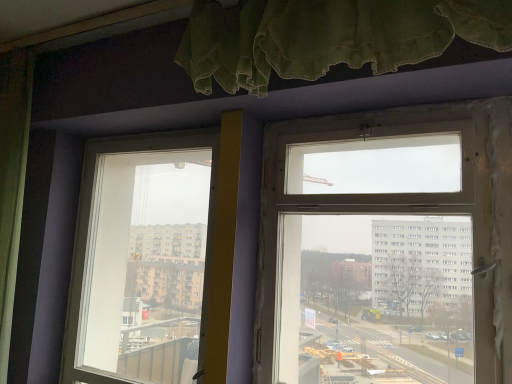
Question: Is clear glass window at upper center, which is the 1th window from right to left, in front of or behind transparent glass window at center, positioned as the 2th window in right-to-left order, in the image?

Choices:
 (A) behind
 (B) front

Answer: (B)

Question: Looking at their shapes, would you say clear glass window at upper center, which is the 1th window from right to left, is wider or thinner than transparent glass window at center, positioned as the 2th window in right-to-left order?

Choices:
 (A) wide
 (B) thin

Answer: (B)

Question: From the image's perspective, is clear glass window at upper center, which is the 2th window in left-to-right order, positioned above or below transparent glass window at center, marked as the first window in a left-to-right arrangement?

Choices:
 (A) below
 (B) above

Answer: (B)

Question: Is transparent glass window at center, positioned as the 2th window in right-to-left order, wider or thinner than clear glass window at upper center, which is the 1th window from right to left?

Choices:
 (A) wide
 (B) thin

Answer: (A)

Question: Is point (186, 135) closer or farther from the camera than point (315, 233)?

Choices:
 (A) farther
 (B) closer

Answer: (A)

Question: From the image's perspective, is transparent glass window at center, positioned as the 2th window in right-to-left order, above or below clear glass window at upper center, which is the 1th window from right to left?

Choices:
 (A) below
 (B) above

Answer: (A)

Question: Considering their positions, is transparent glass window at center, positioned as the first window in back-to-front order, located in front of or behind clear glass window at upper center, acting as the 2th window starting from the back?

Choices:
 (A) front
 (B) behind

Answer: (B)